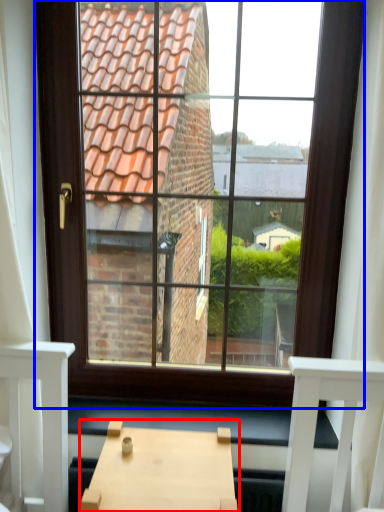
Question: Which of the following is the closest to the observer, table (highlighted by a red box) or window (highlighted by a blue box)?

Choices:
 (A) table
 (B) window

Answer: (A)